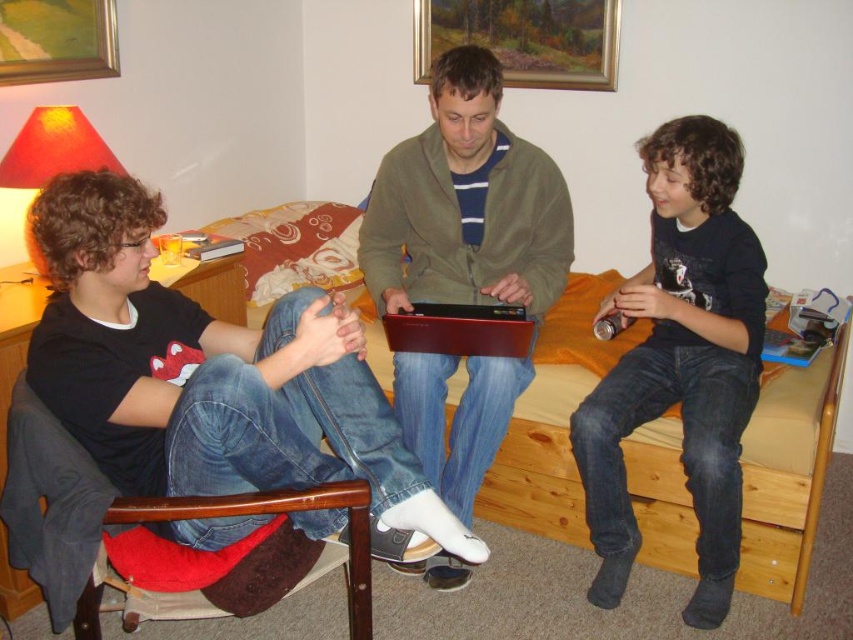
Image resolution: width=853 pixels, height=640 pixels. Describe the element at coordinates (51, 504) in the screenshot. I see `brown wood chair at left` at that location.

Who is more forward, (16,451) or (602,84)?

Point (16,451) is in front.

Is point (0, 513) positioned behind point (523, 81)?

That is False.

Where is `brown wood chair at left`? This screenshot has width=853, height=640. brown wood chair at left is located at coordinates [x=51, y=504].

Is wooden picture frame at upper left below red matte laptop at center?

No, wooden picture frame at upper left is not below red matte laptop at center.

Does wooden picture frame at upper left have a larger size compared to red matte laptop at center?

Indeed, wooden picture frame at upper left has a larger size compared to red matte laptop at center.

Describe the element at coordinates (56, 40) in the screenshot. I see `wooden picture frame at upper left` at that location.

Image resolution: width=853 pixels, height=640 pixels. What are the coordinates of `wooden picture frame at upper left` in the screenshot? It's located at (56, 40).

Between point (608, 300) and point (529, 156), which one is positioned behind?

The point (608, 300) is more distant.

Does black matte shirt at upper right have a larger size compared to matte green jacket at center?

Actually, black matte shirt at upper right might be smaller than matte green jacket at center.

Image resolution: width=853 pixels, height=640 pixels. In order to click on black matte shirt at upper right in this screenshot , I will do `click(682, 362)`.

Find the location of a particular element. This screenshot has height=640, width=853. black matte shirt at upper right is located at coordinates (682, 362).